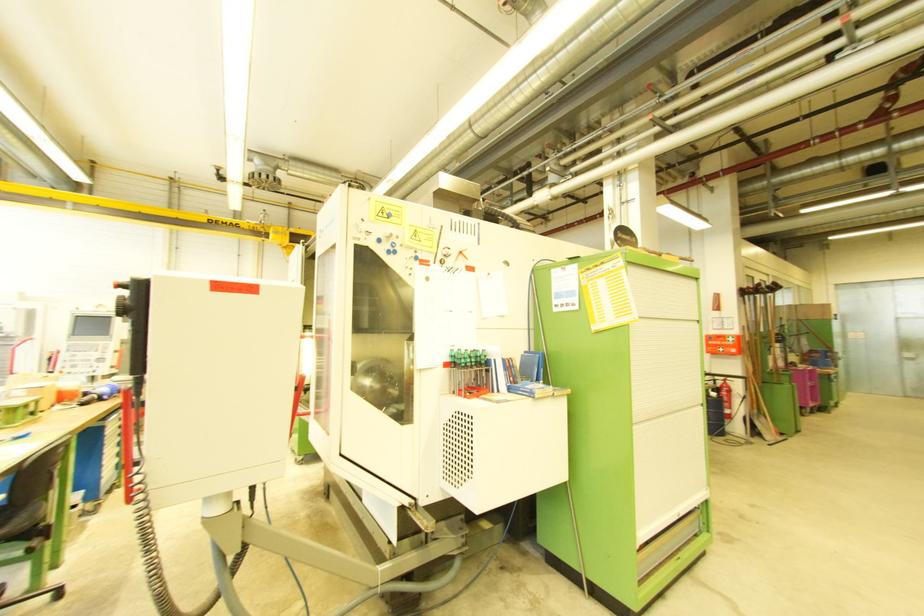
At what (x,y) coordinates should I click in order to perform the action: click on red control knob. Please return your answer as a coordinate pair (x, y). The width and height of the screenshot is (924, 616). Looking at the image, I should click on (122, 286).